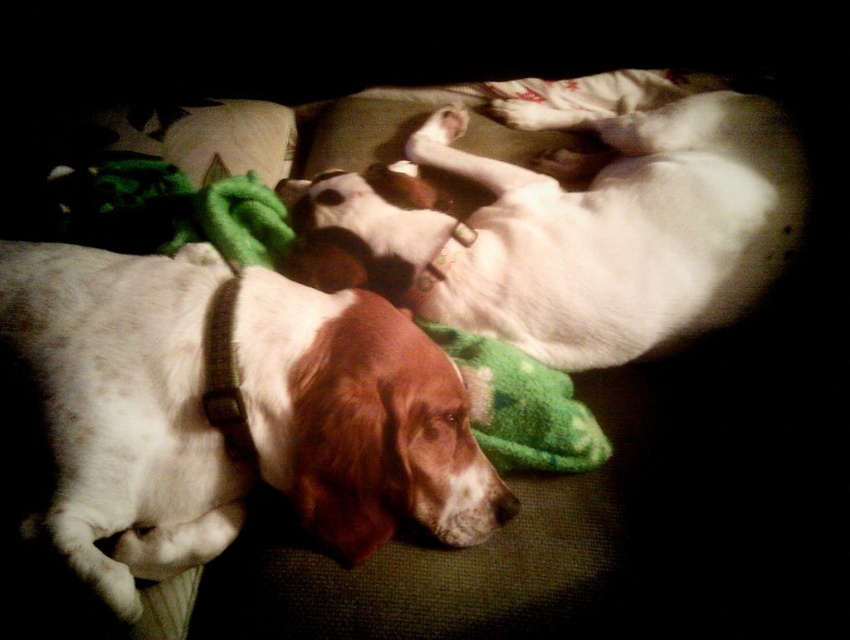
Question: Which object is farther from the camera taking this photo?

Choices:
 (A) white fur dog at center
 (B) white fur dog at upper center

Answer: (B)

Question: Can you confirm if white fur dog at center is bigger than white fur dog at upper center?

Choices:
 (A) yes
 (B) no

Answer: (B)

Question: Is white fur dog at center positioned at the back of white fur dog at upper center?

Choices:
 (A) yes
 (B) no

Answer: (B)

Question: Can you confirm if white fur dog at center is smaller than white fur dog at upper center?

Choices:
 (A) no
 (B) yes

Answer: (B)

Question: Which of the following is the closest to the observer?

Choices:
 (A) tap(120, 380)
 (B) tap(370, 234)

Answer: (A)